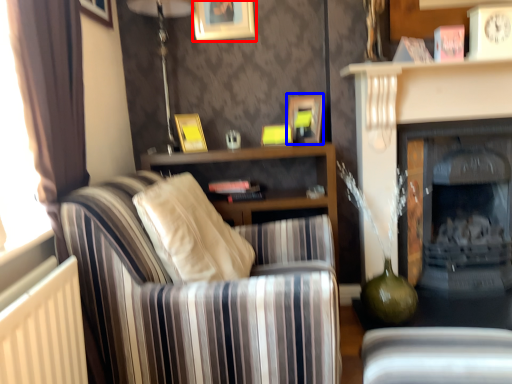
Question: Among these objects, which one is farthest to the camera, picture frame (highlighted by a red box) or picture frame (highlighted by a blue box)?

Choices:
 (A) picture frame
 (B) picture frame

Answer: (A)